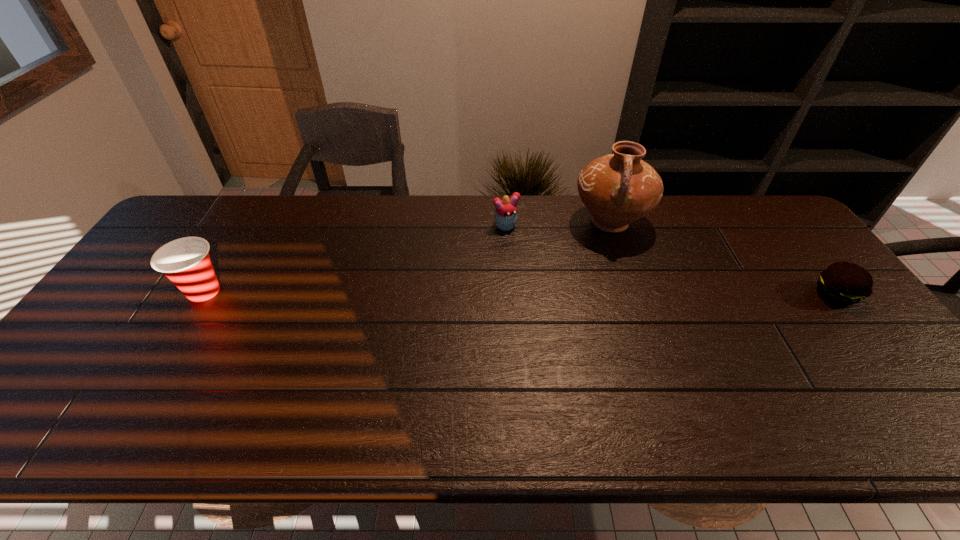
Locate an element on the screen. free space at the left edge of the desktop is located at coordinates (112, 335).

The height and width of the screenshot is (540, 960). I want to click on vacant area at the right edge, so click(766, 251).

In the image, there is a desktop. At what (x,y) coordinates should I click in order to perform the action: click on free region at the far left corner. Please return your answer as a coordinate pair (x, y). The height and width of the screenshot is (540, 960). Looking at the image, I should click on (210, 227).

Where is `blank area at the near left corner`? The width and height of the screenshot is (960, 540). blank area at the near left corner is located at coordinates (72, 382).

In the image, there is a desktop. In order to click on vacant space at the far right corner in this screenshot , I will do `click(729, 199)`.

I want to click on vacant space in between the rightmost object and the second object from right to left, so click(723, 259).

Find the location of `empty space between the patty and the leftmost object`. empty space between the patty and the leftmost object is located at coordinates (519, 293).

This screenshot has width=960, height=540. I want to click on free space between the patty and the cup, so click(x=519, y=293).

Find the location of a particular element. This screenshot has width=960, height=540. unoccupied area between the third tallest object and the rightmost object is located at coordinates (671, 260).

The width and height of the screenshot is (960, 540). Find the location of `vacant point located between the second tallest object and the rightmost object`. vacant point located between the second tallest object and the rightmost object is located at coordinates (519, 293).